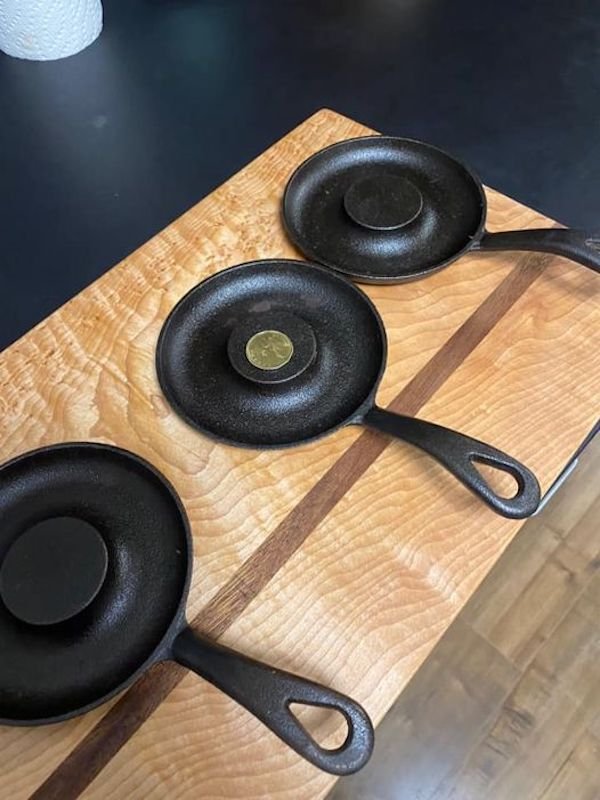
Image resolution: width=600 pixels, height=800 pixels. I want to click on formica countertop, so click(x=82, y=213), click(x=547, y=164).